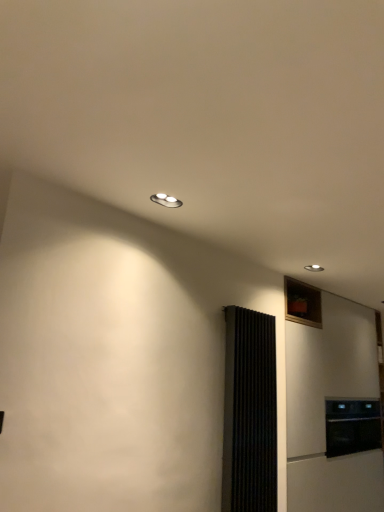
Question: Is black matte oven at lower right not near black ribbed screen door at right?

Choices:
 (A) no
 (B) yes

Answer: (B)

Question: Is black matte oven at lower right closer to camera compared to black ribbed screen door at right?

Choices:
 (A) no
 (B) yes

Answer: (A)

Question: From a real-world perspective, is black matte oven at lower right on top of black ribbed screen door at right?

Choices:
 (A) no
 (B) yes

Answer: (A)

Question: Is black matte oven at lower right facing towards black ribbed screen door at right?

Choices:
 (A) yes
 (B) no

Answer: (B)

Question: From the image's perspective, is black matte oven at lower right over black ribbed screen door at right?

Choices:
 (A) no
 (B) yes

Answer: (A)

Question: Is point (329, 500) positioned closer to the camera than point (344, 426)?

Choices:
 (A) farther
 (B) closer

Answer: (B)

Question: Considering the positions of white matte refrigerator at right and black matte oven at lower right in the image, is white matte refrigerator at right wider or thinner than black matte oven at lower right?

Choices:
 (A) wide
 (B) thin

Answer: (B)

Question: Is white matte refrigerator at right bigger or smaller than black matte oven at lower right?

Choices:
 (A) small
 (B) big

Answer: (B)

Question: Relative to black matte oven at lower right, is white matte refrigerator at right in front or behind?

Choices:
 (A) front
 (B) behind

Answer: (A)

Question: Is black matte oven at lower right taller or shorter than white matte refrigerator at right?

Choices:
 (A) short
 (B) tall

Answer: (A)

Question: In the image, is black matte oven at lower right on the left side or the right side of white matte refrigerator at right?

Choices:
 (A) left
 (B) right

Answer: (B)

Question: In terms of width, does black matte oven at lower right look wider or thinner when compared to white matte refrigerator at right?

Choices:
 (A) thin
 (B) wide

Answer: (B)

Question: From the image's perspective, is black matte oven at lower right above or below white matte refrigerator at right?

Choices:
 (A) above
 (B) below

Answer: (B)

Question: From the image's perspective, is black matte oven at lower right above or below black ribbed screen door at right?

Choices:
 (A) above
 (B) below

Answer: (B)

Question: Considering the positions of black matte oven at lower right and black ribbed screen door at right in the image, is black matte oven at lower right wider or thinner than black ribbed screen door at right?

Choices:
 (A) wide
 (B) thin

Answer: (A)